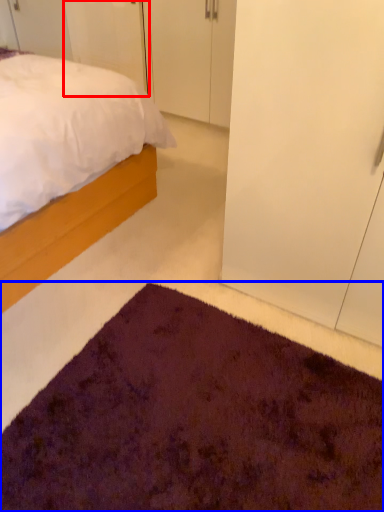
Question: Which of the following is the farthest to the observer, door (highlighted by a red box) or doormat (highlighted by a blue box)?

Choices:
 (A) door
 (B) doormat

Answer: (A)